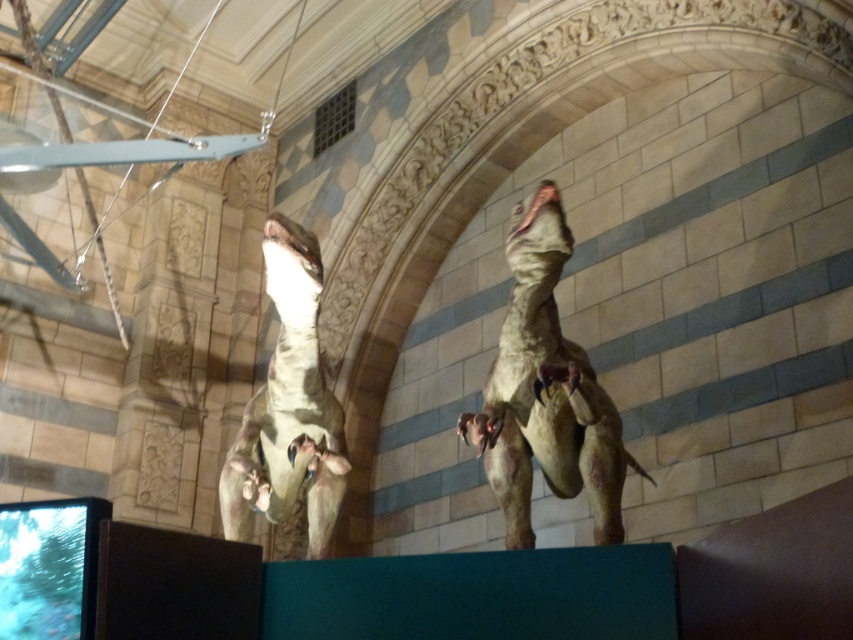
Is matte brown dinosaur at upper center below matte brown dinosaur at left?

Indeed, matte brown dinosaur at upper center is positioned under matte brown dinosaur at left.

Between matte brown dinosaur at upper center and matte brown dinosaur at left, which one has less height?

With less height is matte brown dinosaur at upper center.

The width and height of the screenshot is (853, 640). Identify the location of matte brown dinosaur at upper center. (544, 390).